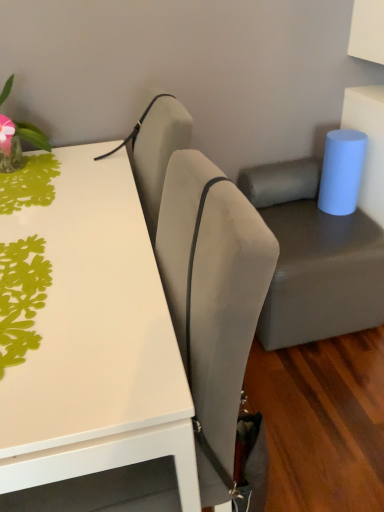
Question: From the image's perspective, is green paper cutout at upper left, the first plant when ordered from bottom to top, under suede-like beige armchair at upper center?

Choices:
 (A) yes
 (B) no

Answer: (A)

Question: Can you confirm if green paper cutout at upper left, the second plant from the top, is wider than suede-like beige armchair at upper center?

Choices:
 (A) no
 (B) yes

Answer: (B)

Question: From the image's perspective, is green paper cutout at upper left, the second plant from the top, located above suede-like beige armchair at upper center?

Choices:
 (A) yes
 (B) no

Answer: (B)

Question: Is green paper cutout at upper left, the first plant when ordered from bottom to top, surrounding suede-like beige armchair at upper center?

Choices:
 (A) yes
 (B) no

Answer: (B)

Question: Is green paper cutout at upper left, the first plant when ordered from bottom to top, turned away from suede-like beige armchair at upper center?

Choices:
 (A) yes
 (B) no

Answer: (B)

Question: Is green paper cutout at upper left, the second plant from the top, further to camera compared to suede-like beige armchair at upper center?

Choices:
 (A) no
 (B) yes

Answer: (A)

Question: Is suede-like beige armchair at upper center taller than green paper cutout at upper left, acting as the first plant starting from the front?

Choices:
 (A) yes
 (B) no

Answer: (A)

Question: From the image's perspective, is suede-like beige armchair at upper center beneath green paper cutout at upper left, the first plant when ordered from bottom to top?

Choices:
 (A) no
 (B) yes

Answer: (A)

Question: Considering the relative positions of suede-like beige armchair at upper center and green paper cutout at upper left, acting as the first plant starting from the front, in the image provided, is suede-like beige armchair at upper center to the right of green paper cutout at upper left, acting as the first plant starting from the front, from the viewer's perspective?

Choices:
 (A) no
 (B) yes

Answer: (B)

Question: Are suede-like beige armchair at upper center and green paper cutout at upper left, the second plant from the top, making contact?

Choices:
 (A) no
 (B) yes

Answer: (A)

Question: Would you say suede-like beige armchair at upper center contains green paper cutout at upper left, marked as the 2th plant in a back-to-front arrangement?

Choices:
 (A) yes
 (B) no

Answer: (B)

Question: From a real-world perspective, is suede-like beige armchair at upper center on top of green paper cutout at upper left, acting as the first plant starting from the front?

Choices:
 (A) yes
 (B) no

Answer: (A)

Question: Is white glossy table at upper left located outside green paper cutout at upper left, the second plant from the top?

Choices:
 (A) no
 (B) yes

Answer: (B)